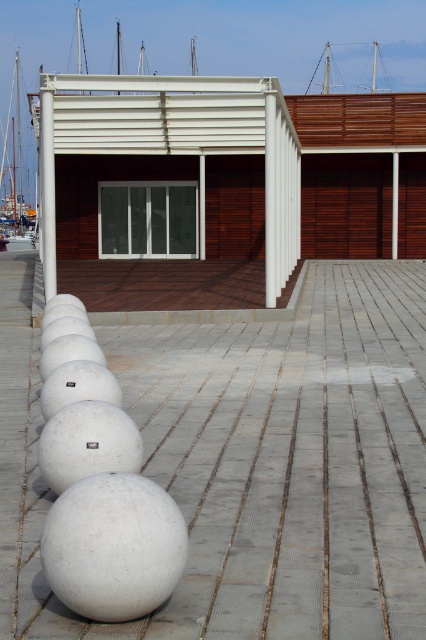
You are standing at the entrance of the building and want to walk towards the point marked as point (17, 164). However, there is an obstacle at point (164, 188). Based on their positions, will you encounter the obstacle before reaching your destination?

Yes, you will encounter the obstacle at point (164, 188) before reaching the destination at point (17, 164) because point (164, 188) is in front of point (17, 164).

You are a delivery person approaching the modern building. You need to determine which object, the transparent glass door at center or the white glossy boat at left, you will encounter first as you walk towards the building from the waterfront promenade. Which one is closer to you?

The transparent glass door at center is closer to you than the white glossy boat at left because it occupies less space, indicating it is nearer in the scene.

You are a visitor approaching the entrance of the building. You see the transparent glass door at center and the white glossy boat at left. Which object is directly above the entrance?

The white glossy boat at left is directly above the entrance because the transparent glass door at center is positioned under it.